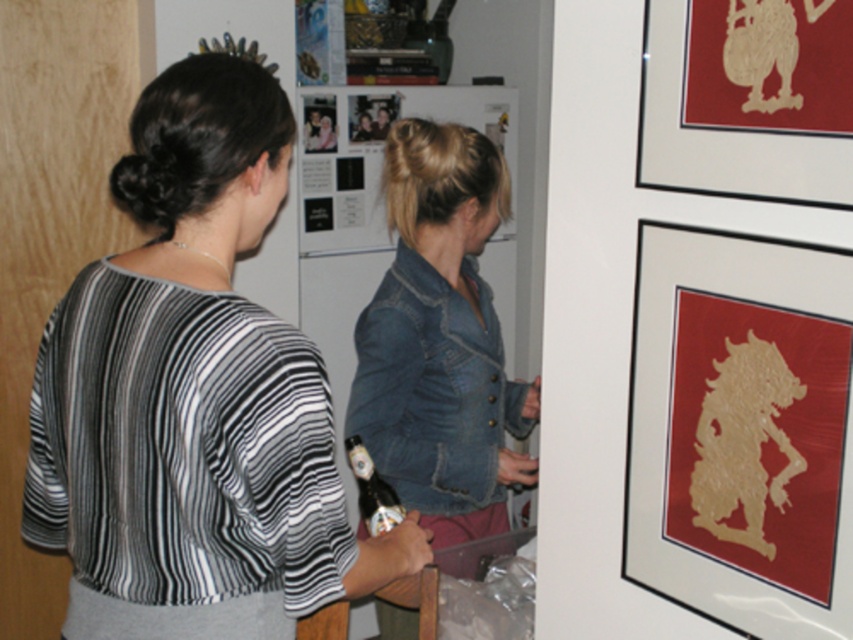
You are arranging items on a table and need to place the striped fabric blouse at left and the gold textured paper at upper right. According to the scene, which item is positioned more to the left?

The striped fabric blouse at left is positioned more to the left than the gold textured paper at upper right.

You are a delivery person who needs to place a small package between the striped fabric blouse at left and the gold paper silhouette at upper right. The package is 50 centimeters long. Can you fit it between them without moving either object?

The distance between the striped fabric blouse at left and the gold paper silhouette at upper right is 55.90 centimeters. Since the package is 50 centimeters long, it can fit between them as there is enough space.

You are standing in front of a table where two people are working. You see two points marked on the table surface at coordinates point (643, 360) and point (691, 67). If you want to place a small object closer to the camera, which point should you choose?

You should choose point (643, 360) because it is closer to the camera compared to point (691, 67).